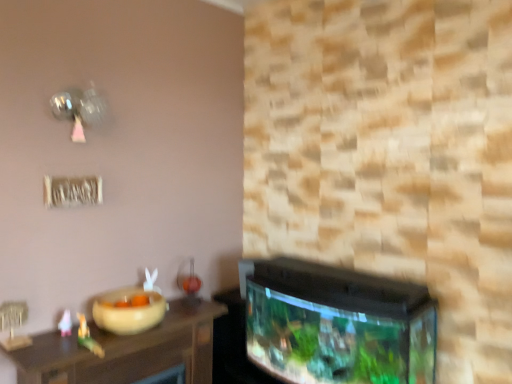
Identify the location of empty space that is ontop of wooden table at lower left (from a real-world perspective). This screenshot has height=384, width=512. (136, 333).